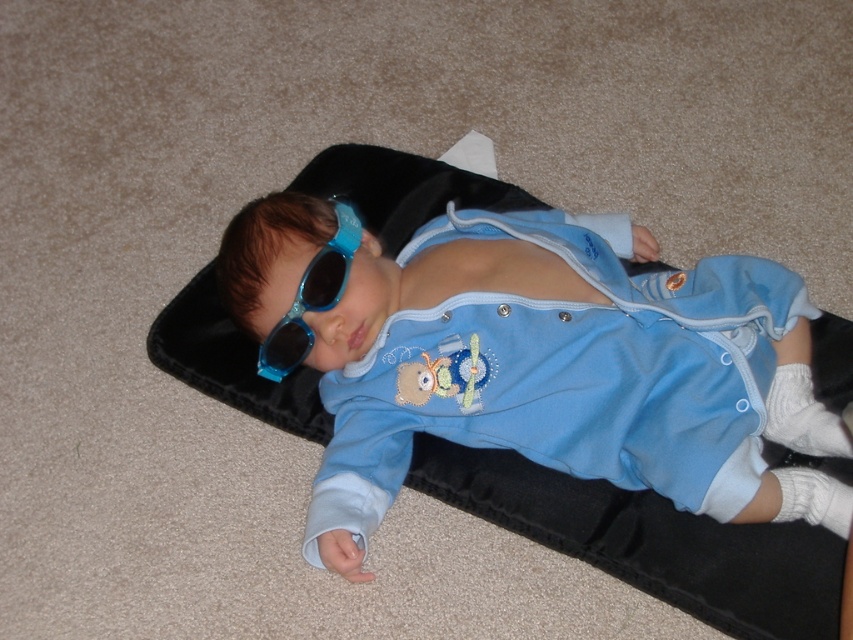
Question: Does blue soft fabric baby at center appear over blue fabric stomach at center?

Choices:
 (A) no
 (B) yes

Answer: (A)

Question: Which of the following is the closest to the observer?

Choices:
 (A) blue shiny sunglasses at center
 (B) blue fabric stomach at center

Answer: (A)

Question: Which object is closer to the camera taking this photo?

Choices:
 (A) blue fabric stomach at center
 (B) blue soft fabric baby at center

Answer: (B)

Question: Is blue fabric stomach at center in front of blue shiny sunglasses at center?

Choices:
 (A) no
 (B) yes

Answer: (A)

Question: Among these points, which one is nearest to the camera?

Choices:
 (A) pyautogui.click(x=334, y=269)
 (B) pyautogui.click(x=534, y=264)
 (C) pyautogui.click(x=480, y=285)

Answer: (A)

Question: Can you confirm if blue soft fabric baby at center is positioned above blue shiny sunglasses at center?

Choices:
 (A) yes
 (B) no

Answer: (B)